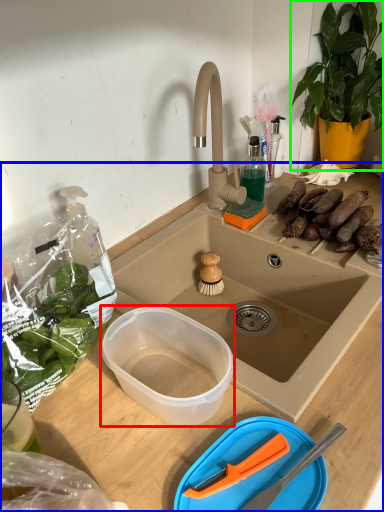
Question: Which object is positioned farthest from bowl (highlighted by a red box)? Select from desk (highlighted by a blue box) and houseplant (highlighted by a green box).

Choices:
 (A) desk
 (B) houseplant

Answer: (B)